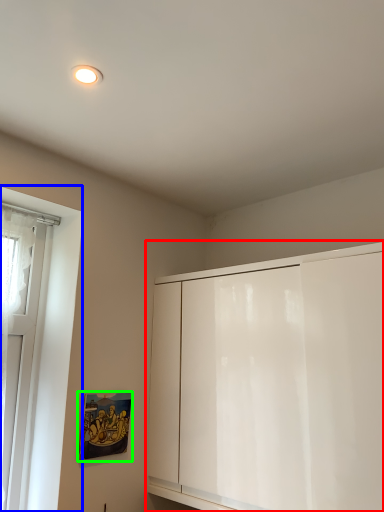
Question: Estimate the real-world distances between objects in this image. Which object is closer to cabinetry (highlighted by a red box), window (highlighted by a blue box) or picture frame (highlighted by a green box)?

Choices:
 (A) window
 (B) picture frame

Answer: (B)